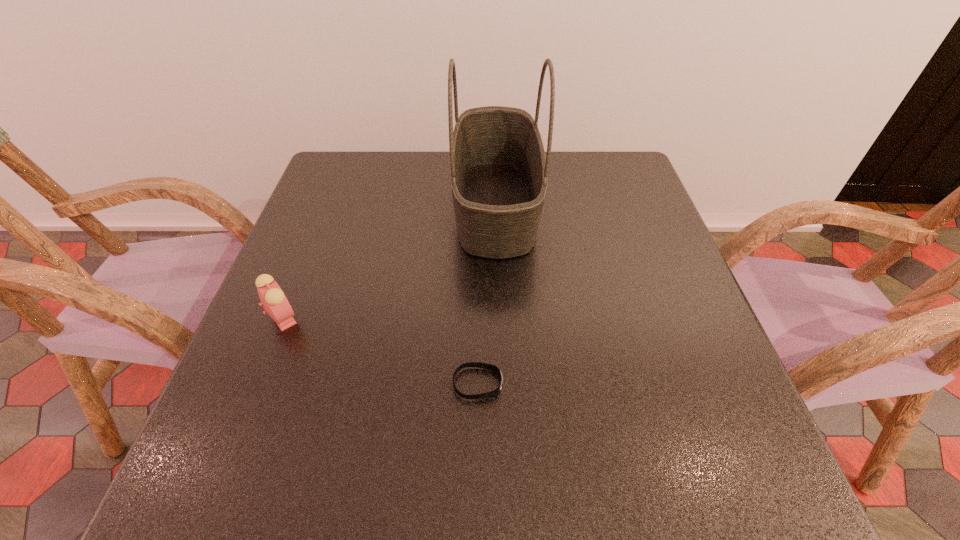
Where is `free space between the leftmost object and the farthest object`? This screenshot has width=960, height=540. free space between the leftmost object and the farthest object is located at coordinates (390, 261).

The image size is (960, 540). I want to click on free space between the nearest object and the second shortest object, so click(x=381, y=350).

You are a GUI agent. You are given a task and a screenshot of the screen. Output one action in this format:
    pyautogui.click(x=<x>, y=<y>)
    Task: Click on the vacant space that is in between the second tallest object and the nearest object
    
    Given the screenshot: What is the action you would take?
    (x=381, y=350)

Where is `unoccupied area between the wristband and the second tallest object`? The width and height of the screenshot is (960, 540). unoccupied area between the wristband and the second tallest object is located at coordinates (381, 350).

Locate an element on the screen. The width and height of the screenshot is (960, 540). free space between the farthest object and the leftmost object is located at coordinates (390, 261).

The image size is (960, 540). In order to click on unoccupied area between the leftmost object and the basket in this screenshot , I will do `click(390, 261)`.

You are a GUI agent. You are given a task and a screenshot of the screen. Output one action in this format:
    pyautogui.click(x=<x>, y=<y>)
    Task: Click on the closest object to the tallest object
    The height and width of the screenshot is (540, 960).
    Given the screenshot: What is the action you would take?
    pyautogui.click(x=491, y=367)

At what (x,y) coordinates should I click in order to perform the action: click on object that is the second closest one to the wristband. Please return your answer as a coordinate pair (x, y). The image size is (960, 540). Looking at the image, I should click on (274, 301).

This screenshot has height=540, width=960. In order to click on vacant space that satisfies the following two spatial constraints: 1. on the front side of the tallest object; 2. on the face of the second shortest object in this screenshot , I will do `click(500, 318)`.

Locate an element on the screen. The width and height of the screenshot is (960, 540). blank space that satisfies the following two spatial constraints: 1. on the front side of the basket; 2. on the face of the second nearest object is located at coordinates (500, 318).